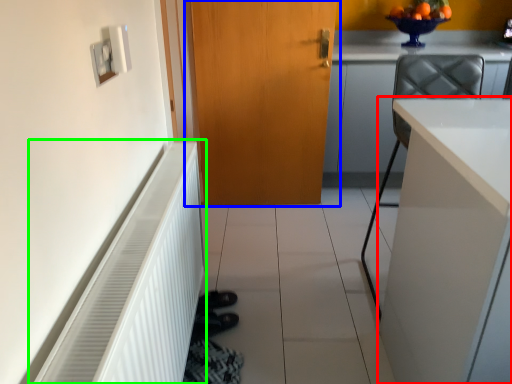
Question: Considering the real-world distances, which object is farthest from cabinetry (highlighted by a red box)? door (highlighted by a blue box) or radiator (highlighted by a green box)?

Choices:
 (A) door
 (B) radiator

Answer: (A)